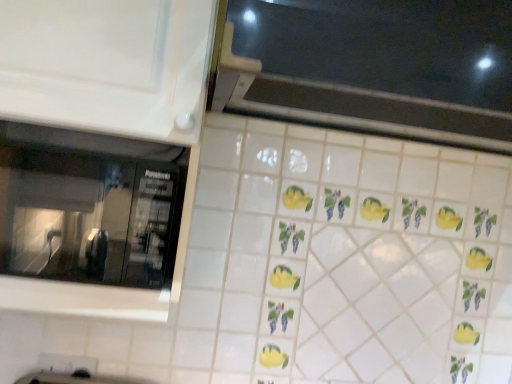
You are a GUI agent. You are given a task and a screenshot of the screen. Output one action in this format:
    pyautogui.click(x=<x>, y=<y>)
    Task: Click on the black glass window at upper center, which ranks as the 1th window in top-to-bottom order
    
    Given the screenshot: What is the action you would take?
    pyautogui.click(x=374, y=67)

What do you see at coordinates (374, 67) in the screenshot? This screenshot has height=384, width=512. I see `black glass window at upper center, the 2th window from the left` at bounding box center [374, 67].

Find the location of `transparent glass microwave at left, the first window positioned from the bottom`. transparent glass microwave at left, the first window positioned from the bottom is located at coordinates (89, 207).

What do you see at coordinates (89, 207) in the screenshot?
I see `transparent glass microwave at left, arranged as the second window when viewed from the right` at bounding box center [89, 207].

In order to face transparent glass microwave at left, the 1th window when ordered from left to right, should I rotate leftwards or rightwards?

To align with it, rotate left about 22.700°.

Identify the location of black glass window at upper center, the second window from the bottom. The height and width of the screenshot is (384, 512). (374, 67).

In the scene shown: Which is more to the right, black glass window at upper center, the second window from the bottom, or transparent glass microwave at left, arranged as the second window when viewed from the right?

Positioned to the right is black glass window at upper center, the second window from the bottom.

Which object is closer to the camera, black glass window at upper center, the second window from the bottom, or transparent glass microwave at left, the first window positioned from the bottom?

black glass window at upper center, the second window from the bottom, is closer to the camera.

Which is in front, point (376, 29) or point (182, 195)?

The point (376, 29) is more forward.

From the image's perspective, is black glass window at upper center, marked as the 1th window in a right-to-left arrangement, beneath transparent glass microwave at left, arranged as the second window when viewed from the right?

Actually, black glass window at upper center, marked as the 1th window in a right-to-left arrangement, appears above transparent glass microwave at left, arranged as the second window when viewed from the right, in the image.

From a real-world perspective, which object stands above the other?

black glass window at upper center, the second window from the bottom.

Considering the sizes of objects black glass window at upper center, marked as the 1th window in a right-to-left arrangement, and transparent glass microwave at left, the second window viewed from the top, in the image provided, who is wider, black glass window at upper center, marked as the 1th window in a right-to-left arrangement, or transparent glass microwave at left, the second window viewed from the top,?

black glass window at upper center, marked as the 1th window in a right-to-left arrangement.

From their relative heights in the image, would you say black glass window at upper center, the 2th window from the left, is taller or shorter than transparent glass microwave at left, the first window positioned from the bottom?

Clearly, black glass window at upper center, the 2th window from the left, is taller compared to transparent glass microwave at left, the first window positioned from the bottom.

Considering the sizes of objects black glass window at upper center, the 2th window from the left, and transparent glass microwave at left, the 1th window when ordered from left to right, in the image provided, who is bigger, black glass window at upper center, the 2th window from the left, or transparent glass microwave at left, the 1th window when ordered from left to right,?

With larger size is black glass window at upper center, the 2th window from the left.

Could transparent glass microwave at left, the second window viewed from the top, be considered to be inside black glass window at upper center, the 2th window from the left?

No.

Is black glass window at upper center, the second window from the bottom, in contact with transparent glass microwave at left, the second window viewed from the top?

No, black glass window at upper center, the second window from the bottom, is not beside transparent glass microwave at left, the second window viewed from the top.

Is black glass window at upper center, marked as the 1th window in a right-to-left arrangement, turned away from transparent glass microwave at left, the 1th window when ordered from left to right?

No, black glass window at upper center, marked as the 1th window in a right-to-left arrangement,'s orientation is not away from transparent glass microwave at left, the 1th window when ordered from left to right.

How many degrees apart are the facing directions of black glass window at upper center, marked as the 1th window in a right-to-left arrangement, and transparent glass microwave at left, the 1th window when ordered from left to right?

The facing directions of black glass window at upper center, marked as the 1th window in a right-to-left arrangement, and transparent glass microwave at left, the 1th window when ordered from left to right, are 3.46 degrees apart.

This screenshot has width=512, height=384. In order to click on window below the black glass window at upper center, marked as the 1th window in a right-to-left arrangement (from a real-world perspective) in this screenshot , I will do `click(89, 207)`.

Based on the photo, can you confirm if transparent glass microwave at left, arranged as the second window when viewed from the right, is positioned to the right of black glass window at upper center, the 2th window from the left?

No.

In the image, is transparent glass microwave at left, the 1th window when ordered from left to right, positioned in front of or behind black glass window at upper center, marked as the 1th window in a right-to-left arrangement?

Clearly, transparent glass microwave at left, the 1th window when ordered from left to right, is behind black glass window at upper center, marked as the 1th window in a right-to-left arrangement.

Does point (80, 194) lie in front of point (291, 81)?

Yes.

From the image's perspective, is transparent glass microwave at left, the first window positioned from the bottom, located above black glass window at upper center, the 2th window from the left?

Incorrect, from the image's perspective, transparent glass microwave at left, the first window positioned from the bottom, is lower than black glass window at upper center, the 2th window from the left.

From a real-world perspective, does transparent glass microwave at left, the first window positioned from the bottom, stand above black glass window at upper center, the second window from the bottom?

No, from a real-world perspective, transparent glass microwave at left, the first window positioned from the bottom, is not above black glass window at upper center, the second window from the bottom.

Considering the sizes of transparent glass microwave at left, arranged as the second window when viewed from the right, and black glass window at upper center, the 2th window from the left, in the image, is transparent glass microwave at left, arranged as the second window when viewed from the right, wider or thinner than black glass window at upper center, the 2th window from the left,?

transparent glass microwave at left, arranged as the second window when viewed from the right, is thinner than black glass window at upper center, the 2th window from the left.

Between transparent glass microwave at left, the first window positioned from the bottom, and black glass window at upper center, the second window from the bottom, which one has more height?

With more height is black glass window at upper center, the second window from the bottom.

Can you confirm if transparent glass microwave at left, the second window viewed from the top, is bigger than black glass window at upper center, marked as the 1th window in a right-to-left arrangement?

No, transparent glass microwave at left, the second window viewed from the top, is not bigger than black glass window at upper center, marked as the 1th window in a right-to-left arrangement.

Is transparent glass microwave at left, the second window viewed from the top, positioned beyond the bounds of black glass window at upper center, which ranks as the 1th window in top-to-bottom order?

Yes, transparent glass microwave at left, the second window viewed from the top, is outside of black glass window at upper center, which ranks as the 1th window in top-to-bottom order.

Are transparent glass microwave at left, the second window viewed from the top, and black glass window at upper center, which ranks as the 1th window in top-to-bottom order, making contact?

No.

Is transparent glass microwave at left, arranged as the second window when viewed from the right, positioned with its back to black glass window at upper center, the second window from the bottom?

No.

Can you tell me how much transparent glass microwave at left, arranged as the second window when viewed from the right, and black glass window at upper center, which ranks as the 1th window in top-to-bottom order, differ in facing direction?

There is a 3.46-degree angle between the facing directions of transparent glass microwave at left, arranged as the second window when viewed from the right, and black glass window at upper center, which ranks as the 1th window in top-to-bottom order.

Locate an element on the screen. Image resolution: width=512 pixels, height=384 pixels. window below the black glass window at upper center, which ranks as the 1th window in top-to-bottom order (from the image's perspective) is located at coordinates (89, 207).

At what (x,y) coordinates should I click in order to perform the action: click on window on the right of transparent glass microwave at left, the first window positioned from the bottom. Please return your answer as a coordinate pair (x, y). Looking at the image, I should click on (374, 67).

Where is `window above the transparent glass microwave at left, the first window positioned from the bottom (from a real-world perspective)`? The width and height of the screenshot is (512, 384). window above the transparent glass microwave at left, the first window positioned from the bottom (from a real-world perspective) is located at coordinates pyautogui.click(x=374, y=67).